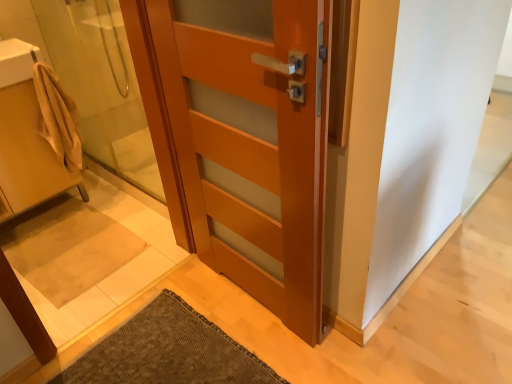
Identify the location of free space above beige fabric bath mat at lower left (from a real-world perspective). (54, 238).